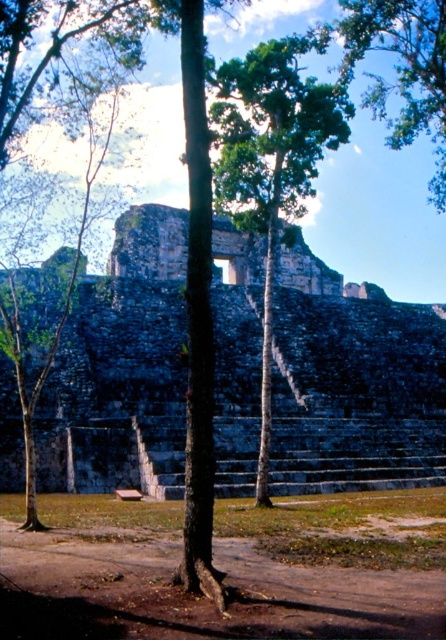
Question: Can you confirm if gray stone amphitheater at center is positioned to the right of green leafy tree at center?

Choices:
 (A) yes
 (B) no

Answer: (B)

Question: Which of the following is the farthest from the observer?

Choices:
 (A) green leafy tree at center
 (B) gray stone amphitheater at center

Answer: (B)

Question: Can you confirm if gray stone amphitheater at center is bigger than green leafy tree at center?

Choices:
 (A) no
 (B) yes

Answer: (B)

Question: Is gray stone amphitheater at center bigger than green leafy tree at center?

Choices:
 (A) no
 (B) yes

Answer: (B)

Question: Among these objects, which one is farthest from the camera?

Choices:
 (A) gray stone amphitheater at center
 (B) green leafy tree at center

Answer: (A)